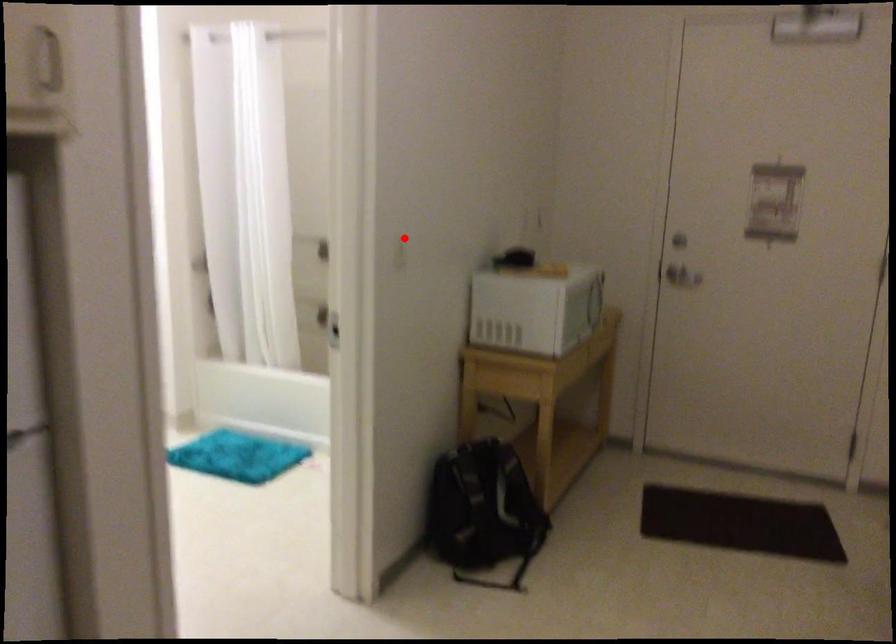
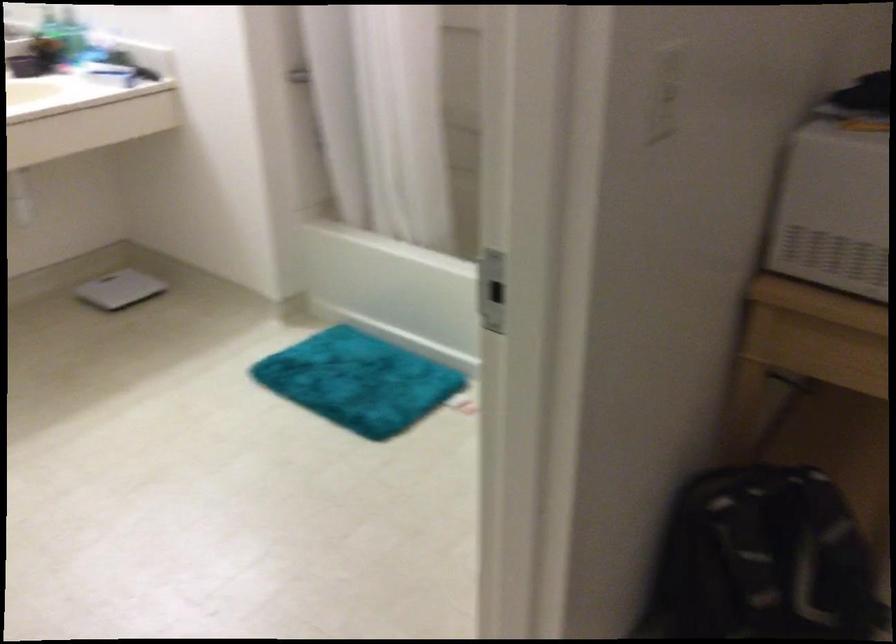
In the second image, find the point that corresponds to the highlighted location in the first image.

(666, 93)